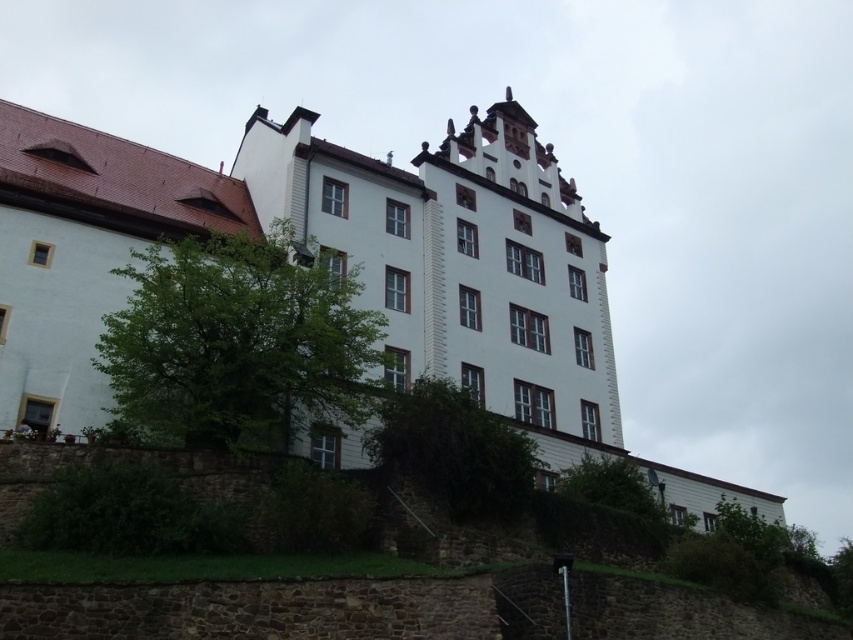
The width and height of the screenshot is (853, 640). I want to click on green leafy tree at center, so click(239, 342).

Who is positioned more to the left, green leafy tree at center or green leafy bush at center?

Answer: green leafy tree at center is more to the left.

Image resolution: width=853 pixels, height=640 pixels. What are the coordinates of `green leafy tree at center` in the screenshot? It's located at (239, 342).

Between green leafy tree at center and green leafy tree at lower right, which one appears on the right side from the viewer's perspective?

green leafy tree at lower right

Who is higher up, green leafy tree at center or green leafy tree at lower right?

Positioned higher is green leafy tree at center.

Where is `green leafy tree at center`? green leafy tree at center is located at coordinates (239, 342).

Describe the element at coordinates (454, 451) in the screenshot. I see `green leafy bush at center` at that location.

Between point (497, 496) and point (607, 461), which one is positioned in front?

Point (497, 496) is more forward.

Where is `green leafy bush at center`? Image resolution: width=853 pixels, height=640 pixels. green leafy bush at center is located at coordinates (454, 451).